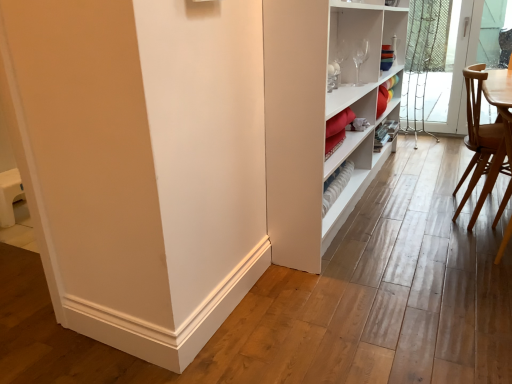
Question: Is clear glass screen door at right to the left of light brown wooden chair at right from the viewer's perspective?

Choices:
 (A) yes
 (B) no

Answer: (B)

Question: Is clear glass screen door at right with light brown wooden chair at right?

Choices:
 (A) no
 (B) yes

Answer: (A)

Question: Can you confirm if clear glass screen door at right is smaller than light brown wooden chair at right?

Choices:
 (A) no
 (B) yes

Answer: (B)

Question: Is clear glass screen door at right oriented away from light brown wooden chair at right?

Choices:
 (A) no
 (B) yes

Answer: (A)

Question: Can you confirm if clear glass screen door at right is bigger than light brown wooden chair at right?

Choices:
 (A) no
 (B) yes

Answer: (A)

Question: From a real-world perspective, does clear glass screen door at right sit lower than light brown wooden chair at right?

Choices:
 (A) no
 (B) yes

Answer: (A)

Question: Considering the relative positions of light brown wooden chair at right and clear glass screen door at right in the image provided, is light brown wooden chair at right to the left of clear glass screen door at right from the viewer's perspective?

Choices:
 (A) yes
 (B) no

Answer: (A)

Question: Is light brown wooden chair at right wider than clear glass screen door at right?

Choices:
 (A) yes
 (B) no

Answer: (A)

Question: Is light brown wooden chair at right oriented towards clear glass screen door at right?

Choices:
 (A) yes
 (B) no

Answer: (B)

Question: Considering the relative sizes of light brown wooden chair at right and clear glass screen door at right in the image provided, is light brown wooden chair at right thinner than clear glass screen door at right?

Choices:
 (A) yes
 (B) no

Answer: (B)

Question: From a real-world perspective, is light brown wooden chair at right below clear glass screen door at right?

Choices:
 (A) yes
 (B) no

Answer: (A)

Question: Is light brown wooden chair at right far from clear glass screen door at right?

Choices:
 (A) yes
 (B) no

Answer: (A)

Question: Which is correct: light brown wooden chair at right is inside clear glass screen door at right, or outside of it?

Choices:
 (A) inside
 (B) outside

Answer: (B)